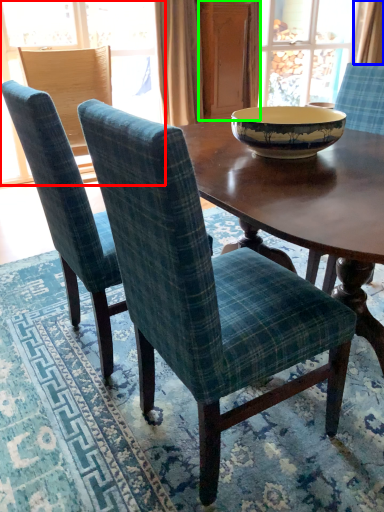
Question: Estimate the real-world distances between objects in this image. Which object is farther from window (highlighted by a red box), curtain (highlighted by a blue box) or screen door (highlighted by a green box)?

Choices:
 (A) curtain
 (B) screen door

Answer: (A)